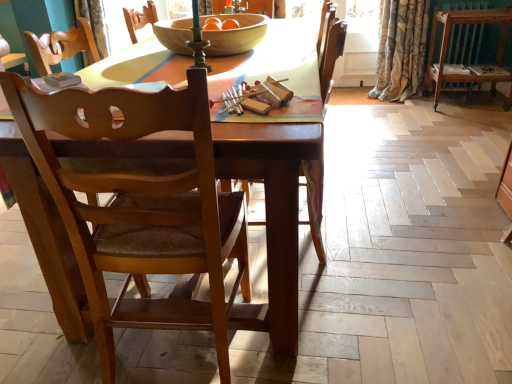
Question: Based on their sizes in the image, would you say floral velvet curtain at upper right is bigger or smaller than brown wooden radiator at upper right?

Choices:
 (A) big
 (B) small

Answer: (A)

Question: From the image's perspective, is floral velvet curtain at upper right located above or below brown wooden radiator at upper right?

Choices:
 (A) above
 (B) below

Answer: (A)

Question: Which is farther from the floral velvet curtain at upper right?

Choices:
 (A) wooden chair at center, the first chair from the right
 (B) wooden bowl at center
 (C) brown wooden radiator at upper right
 (D) wooden chair at center, which appears as the 2th chair when viewed from the right
 (E) brown wood dresser at right

Answer: (D)

Question: Which object is positioned farthest from the wooden chair at center, which is counted as the 2th chair, starting from the left?

Choices:
 (A) floral velvet curtain at upper right
 (B) wooden bowl at center
 (C) brown wood dresser at right
 (D) brown wooden radiator at upper right
 (E) wooden chair at center, which appears as the 2th chair when viewed from the right

Answer: (D)